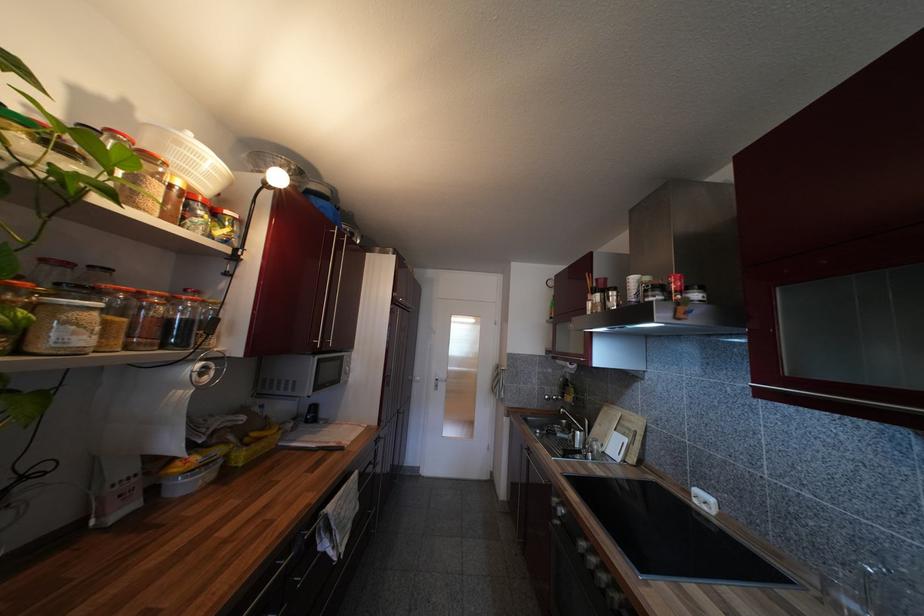
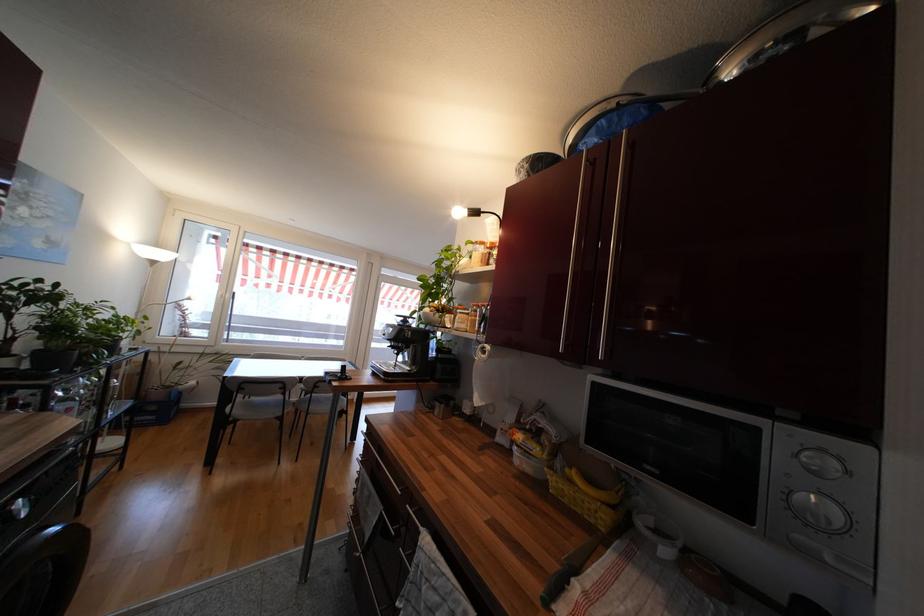
Find the pixel in the second image that matches (250,440) in the first image.

(572, 472)